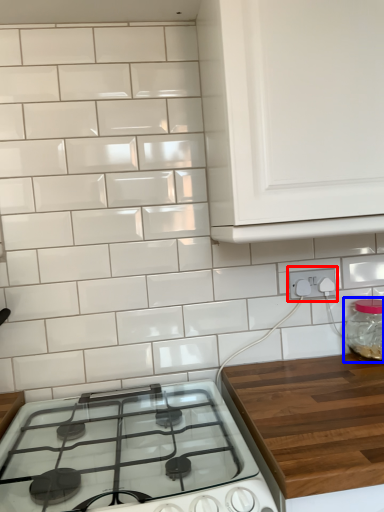
Question: Among these objects, which one is nearest to the camera, electric outlet (highlighted by a red box) or glass jar (highlighted by a blue box)?

Choices:
 (A) electric outlet
 (B) glass jar

Answer: (B)